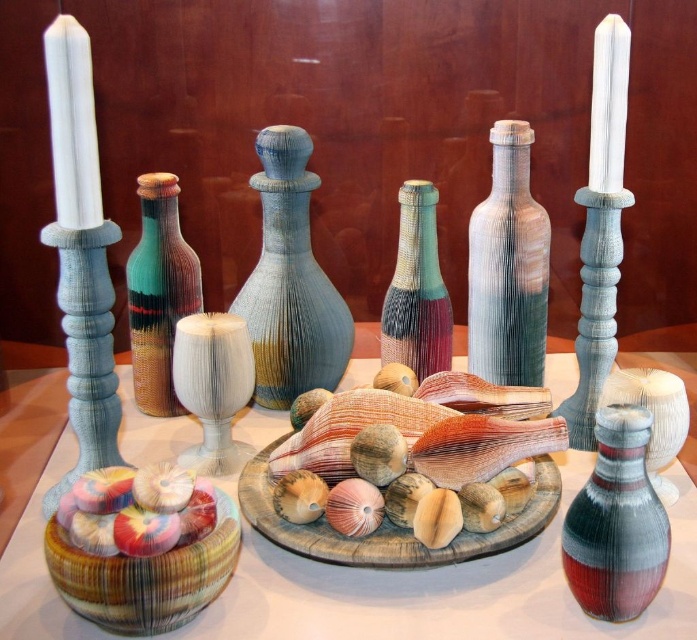
Question: Where is textured wood platter at center located in relation to textured multicolored vase at center in the image?

Choices:
 (A) above
 (B) below

Answer: (B)

Question: Estimate the real-world distances between objects in this image. Which object is closer to the white textured candle holder at center?

Choices:
 (A) textured blue vase at center
 (B) striped fabric vase at center
 (C) textured wood platter at center

Answer: (A)

Question: Can you confirm if white textured candle holder at center is wider than textured wood candle holder at center?

Choices:
 (A) no
 (B) yes

Answer: (A)

Question: Is textured wood platter at center wider than textured wood candle holder at center?

Choices:
 (A) yes
 (B) no

Answer: (A)

Question: Which point is closer to the camera?

Choices:
 (A) textured blue vase at center
 (B) textured wood platter at center
 (C) multicolored woven vase at center
 (D) textured wood candle holder at center

Answer: (D)

Question: Which point is farther to the camera?

Choices:
 (A) textured multicolored vase at center
 (B) multicolored woven vase at center

Answer: (A)